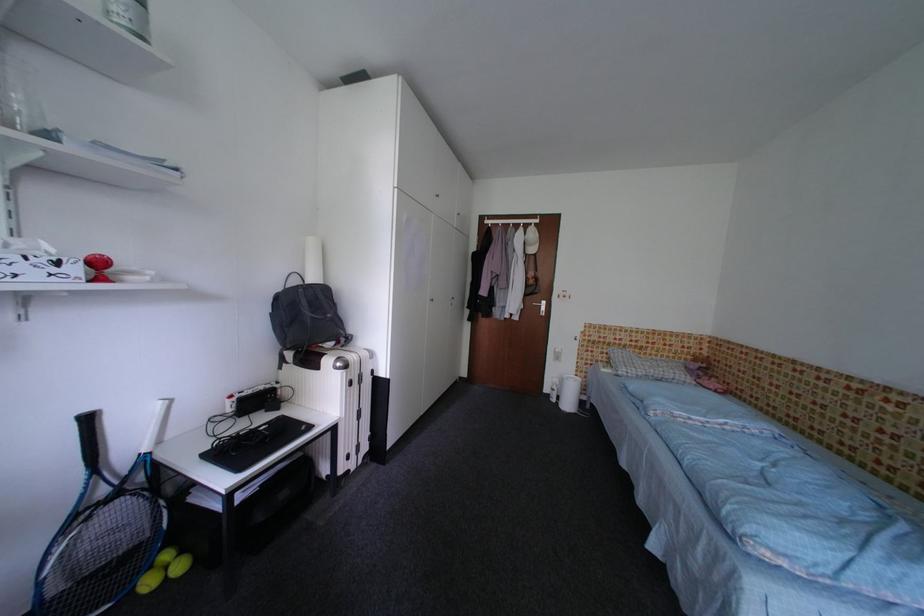
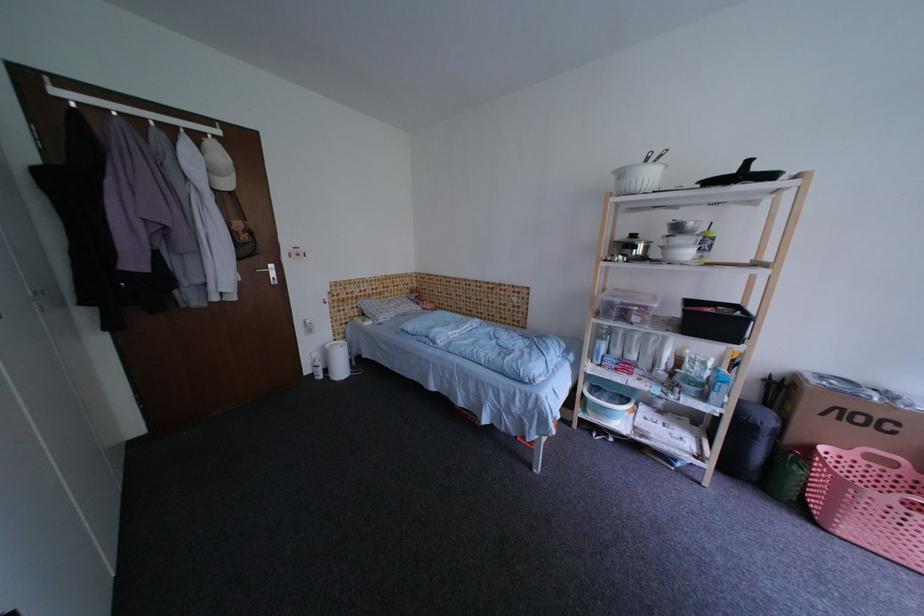
The first image is from the beginning of the video and the second image is from the end. How did the camera likely rotate when shooting the video?

The camera rotated toward right-down.